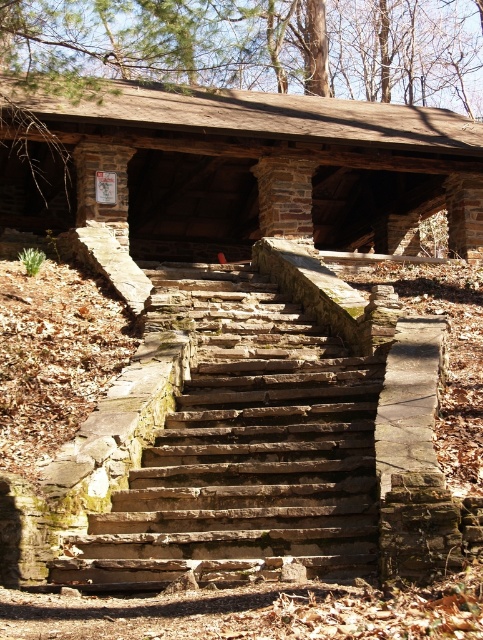
You are planning to build a new deck adjacent to the rusty stone stairs at center and the wooden log cabin at center. Considering their heights, which structure should the deck be built higher than to ensure proper drainage?

The deck should be built higher than the rusty stone stairs at center because the wooden log cabin at center is taller, and the deck needs to slope away from the cabin for drainage purposes.

You are standing at the base of the rustic stone staircase and want to take a photo that includes both point A at point (145, 532) and point B at point (187, 125). Which point should you focus on first to ensure both are in sharp focus?

You should focus on point A at point (145, 532) first because it is closer to the camera, ensuring both points will be in focus when using a proper depth of field.